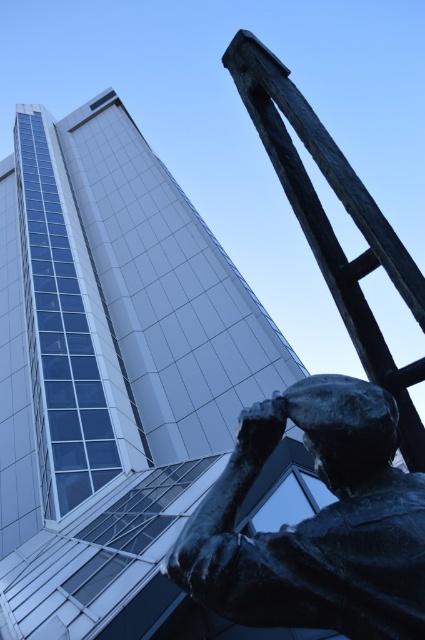
Question: Which point is farther to the camera?

Choices:
 (A) bronze statue at lower right
 (B) smooth glass tower at upper left

Answer: (B)

Question: Does smooth glass tower at upper left appear on the left side of bronze statue at lower right?

Choices:
 (A) no
 (B) yes

Answer: (B)

Question: Which point is closer to the camera taking this photo?

Choices:
 (A) (357, 497)
 (B) (110, 568)

Answer: (A)

Question: Is smooth glass tower at upper left thinner than bronze statue at lower right?

Choices:
 (A) yes
 (B) no

Answer: (B)

Question: Which of the following is the farthest from the observer?

Choices:
 (A) (226, 577)
 (B) (328, 273)
 (C) (198, 440)

Answer: (C)

Question: Does smooth glass tower at upper left have a greater width compared to bronze textured ladder at upper right?

Choices:
 (A) no
 (B) yes

Answer: (B)